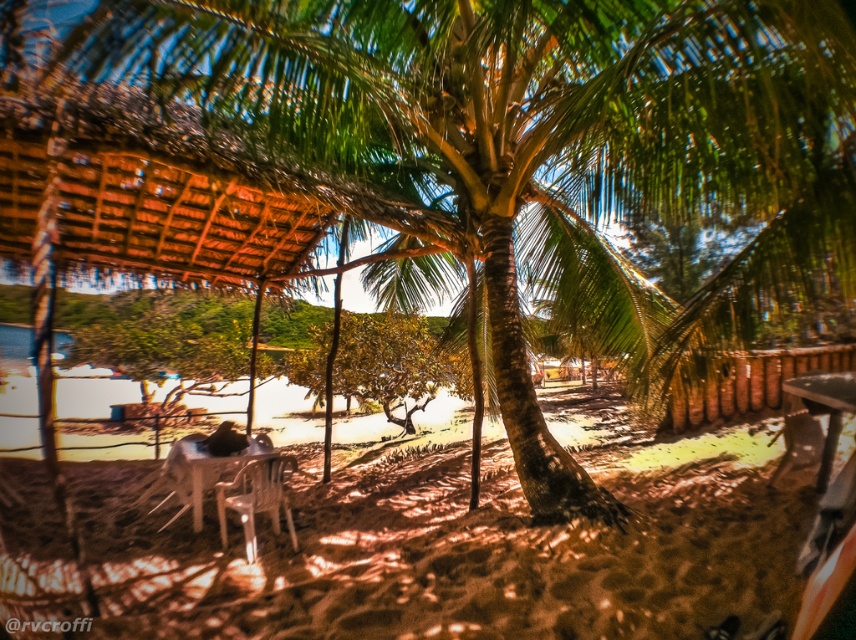
Question: Is thatched brown roof at upper left closer to camera compared to white plastic table at center?

Choices:
 (A) no
 (B) yes

Answer: (B)

Question: Which object is farther from the camera taking this photo?

Choices:
 (A) thatched brown roof at upper left
 (B) white plastic table at center
 (C) translucent plastic chair at center

Answer: (B)

Question: Where is beige sand at center located in relation to translucent plastic chair at center in the image?

Choices:
 (A) below
 (B) above

Answer: (A)

Question: Which object is closer to the camera taking this photo?

Choices:
 (A) thatched brown roof at upper left
 (B) translucent plastic chair at center
 (C) metallic silver table at lower right

Answer: (A)

Question: Which of the following is the closest to the observer?

Choices:
 (A) thatched brown roof at upper left
 (B) beige sand at center
 (C) white plastic chair at lower left
 (D) translucent plastic chair at center

Answer: (A)

Question: Does thatched brown roof at upper left lie in front of white plastic table at center?

Choices:
 (A) yes
 (B) no

Answer: (A)